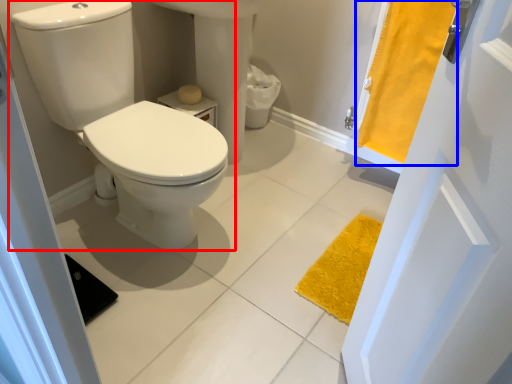
Question: Which object is closer to the camera taking this photo, toilet (highlighted by a red box) or curtain (highlighted by a blue box)?

Choices:
 (A) toilet
 (B) curtain

Answer: (A)